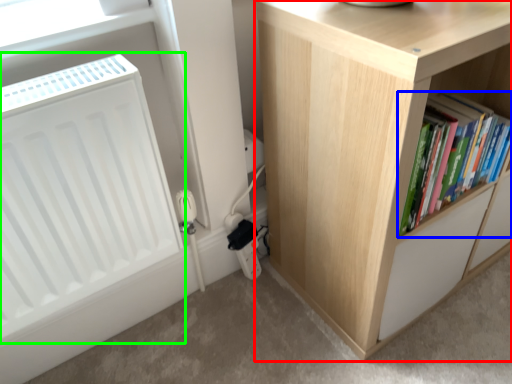
Question: Estimate the real-world distances between objects in this image. Which object is closer to cupboard (highlighted by a red box), book (highlighted by a blue box) or radiator (highlighted by a green box)?

Choices:
 (A) book
 (B) radiator

Answer: (A)